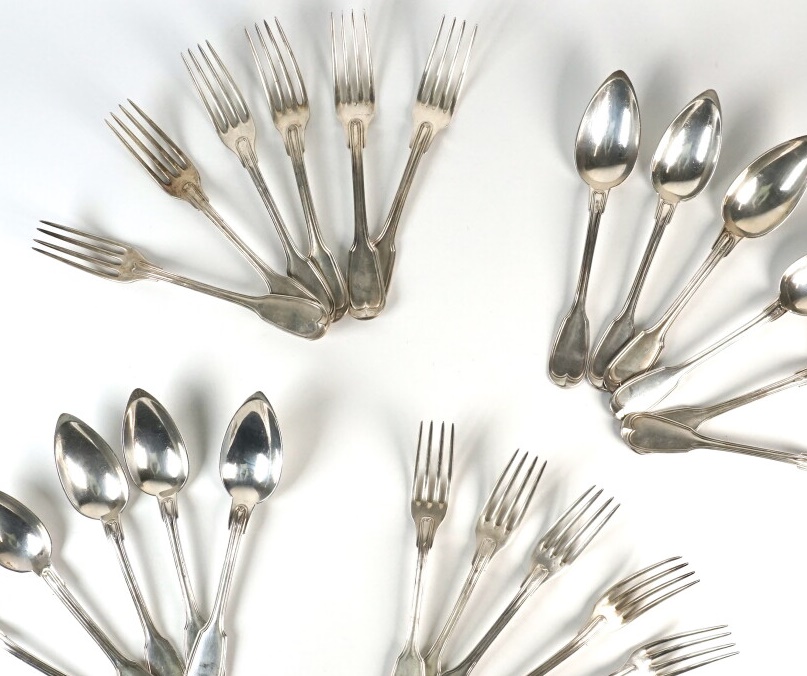
Where is `spoons on the left side of the image`? Image resolution: width=807 pixels, height=676 pixels. spoons on the left side of the image is located at coordinates (244, 510), (170, 512), (118, 529), (51, 573), (21, 646).